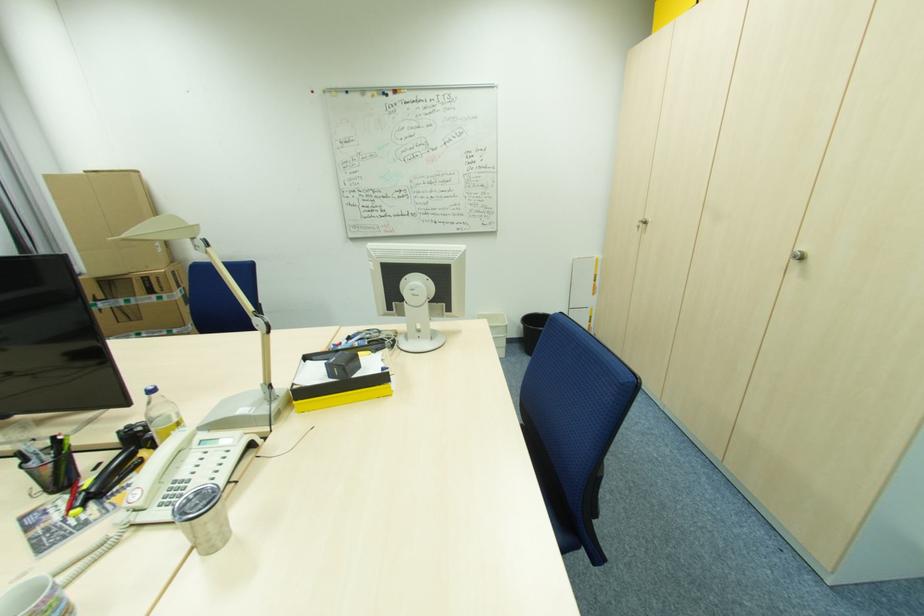
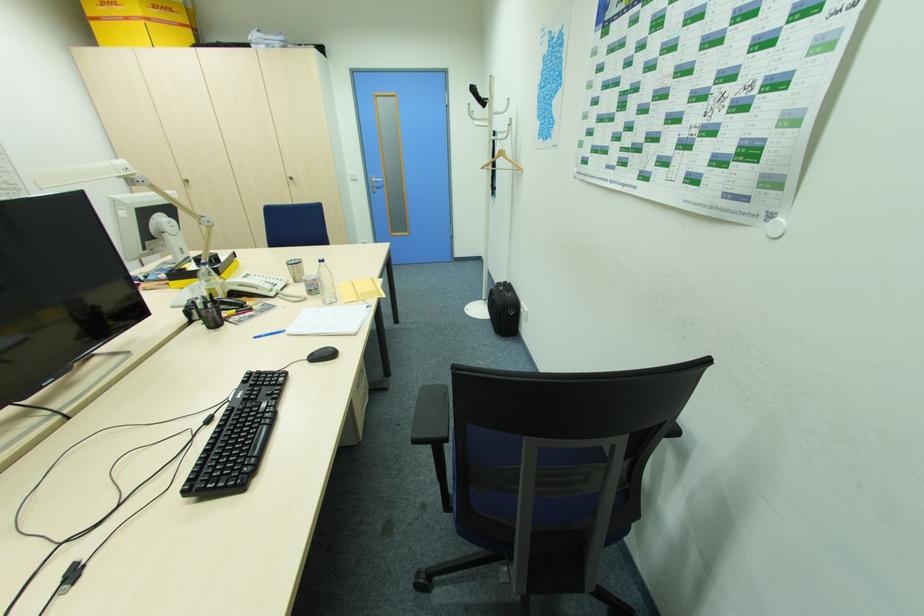
In the second image, find the point that corresponds to [806,248] in the first image.

(292, 176)